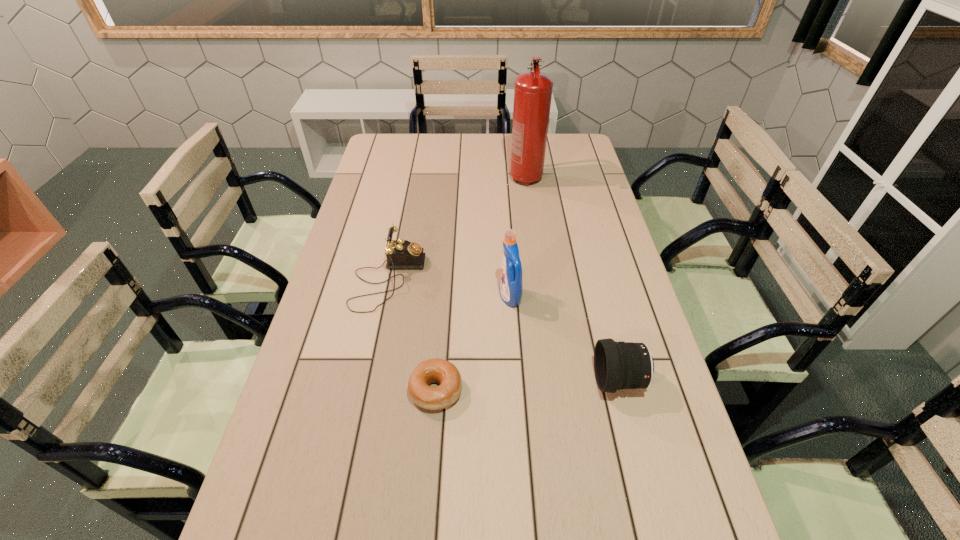
At what (x,y) coordinates should I click in order to perform the action: click on free space located on the label of the fourth shortest object. Please return your answer as a coordinate pair (x, y). The image size is (960, 540). Looking at the image, I should click on (469, 297).

In order to click on free space located 0.400m at the front element of the rightmost object in this screenshot , I will do `click(435, 380)`.

This screenshot has height=540, width=960. What are the coordinates of `vacant space located 0.250m at the front element of the rightmost object` in the screenshot? It's located at (495, 380).

Image resolution: width=960 pixels, height=540 pixels. What are the coordinates of `vacant space positioned at the front element of the rightmost object` in the screenshot? It's located at (551, 380).

This screenshot has height=540, width=960. Find the location of `free space located on the dial of the telephone`. free space located on the dial of the telephone is located at coordinates (468, 279).

You are a GUI agent. You are given a task and a screenshot of the screen. Output one action in this format:
    pyautogui.click(x=<x>, y=<y>)
    Task: Click on the vacant space situated on the left of the second object from left to right
    
    Given the screenshot: What is the action you would take?
    pyautogui.click(x=303, y=390)

Image resolution: width=960 pixels, height=540 pixels. I want to click on object present at the left edge, so click(401, 254).

Find the location of a particular element. This screenshot has width=960, height=540. object located at the right edge is located at coordinates (617, 365).

This screenshot has width=960, height=540. Find the location of `free region at the far edge of the desktop`. free region at the far edge of the desktop is located at coordinates 474,136.

Identify the location of free location at the left edge of the desktop. This screenshot has height=540, width=960. (348, 248).